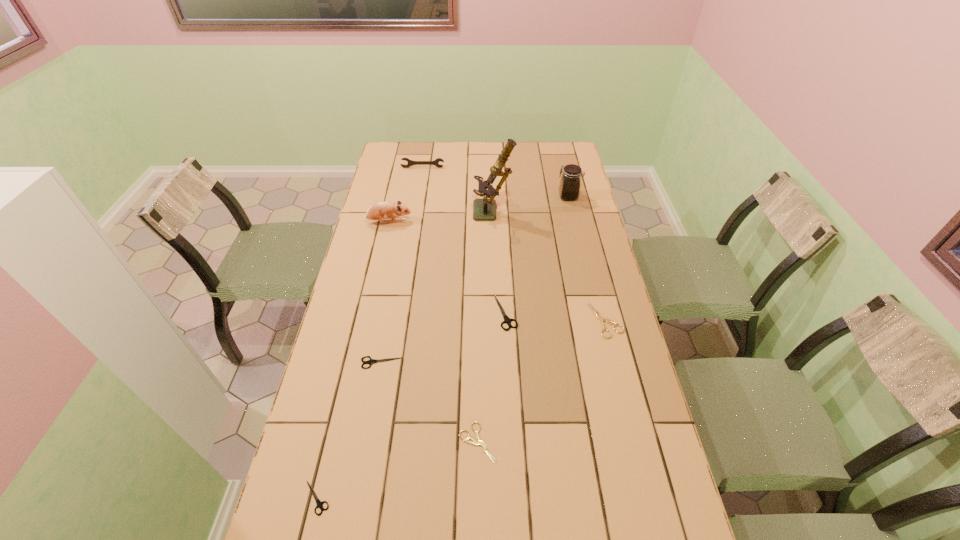
Locate an element on the screen. The height and width of the screenshot is (540, 960). brown microscope is located at coordinates (483, 209).

Find the location of a particular element. The height and width of the screenshot is (540, 960). the tallest object is located at coordinates (483, 209).

What are the coordinates of `jar` in the screenshot? It's located at (570, 181).

You are a GUI agent. You are given a task and a screenshot of the screen. Output one action in this format:
    pyautogui.click(x=<x>, y=<y>)
    Task: Click on the third tallest object
    The width and height of the screenshot is (960, 540).
    Given the screenshot: What is the action you would take?
    pyautogui.click(x=382, y=210)

The width and height of the screenshot is (960, 540). What are the coordinates of `hamster` in the screenshot? It's located at (382, 210).

Find the location of a particular element. the farthest object is located at coordinates (410, 162).

At what (x,y) coordinates should I click in order to perform the action: click on wrench. Please return your answer as a coordinate pair (x, y). Looking at the image, I should click on (410, 162).

The width and height of the screenshot is (960, 540). In order to click on the tallest shears in this screenshot , I will do `click(507, 320)`.

Identify the location of the biggest black shears. The height and width of the screenshot is (540, 960). (507, 320).

This screenshot has width=960, height=540. Identify the location of the second smallest black shears. (371, 361).